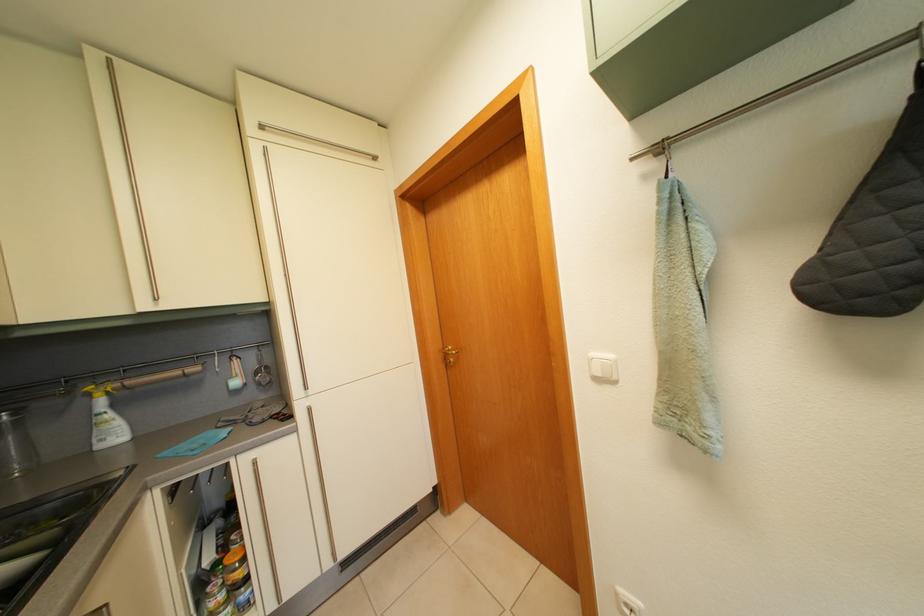
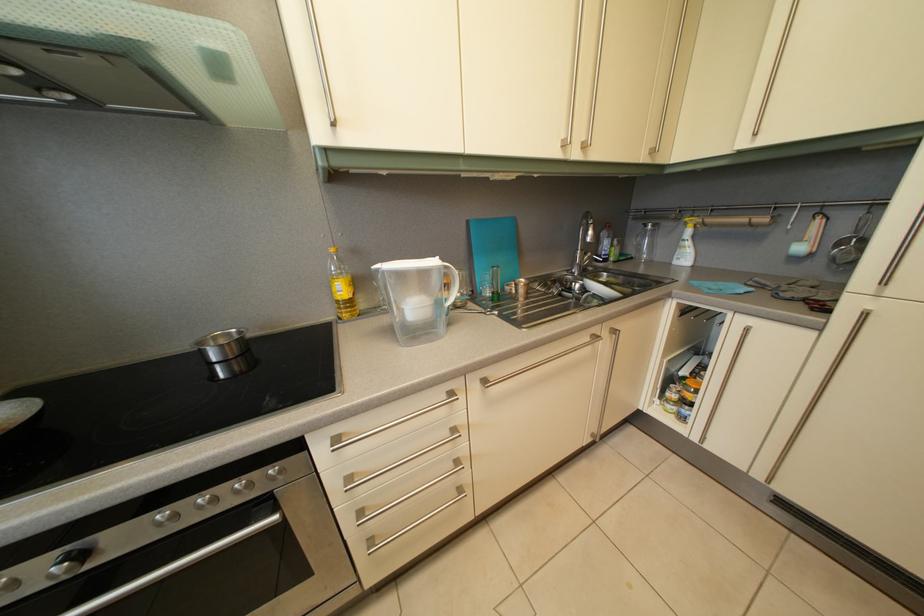
Find the pixel in the second image that matches [98,402] in the first image.

(694, 232)